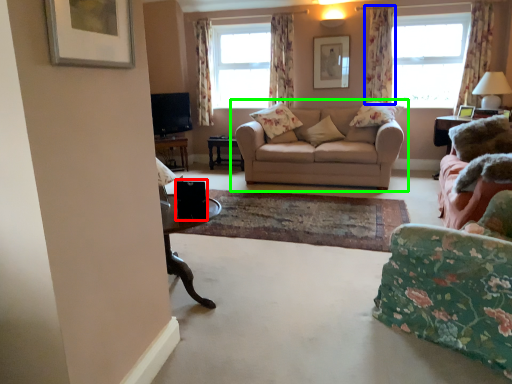
Question: Which is nearer to the speaker (highlighted by a red box)? curtain (highlighted by a blue box) or studio couch (highlighted by a green box).

Choices:
 (A) curtain
 (B) studio couch

Answer: (B)